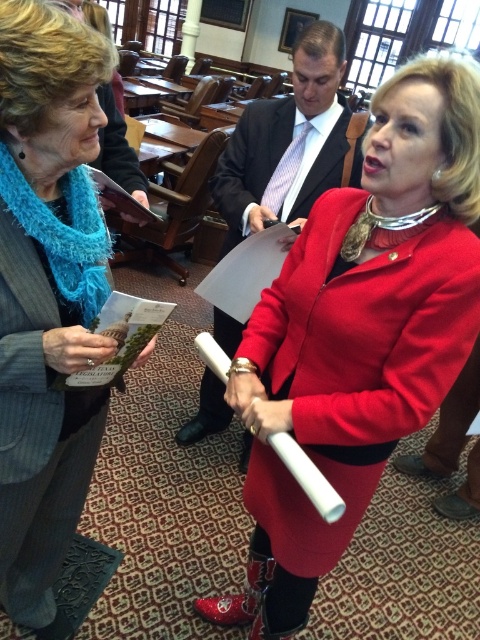
Question: Does matte red coat at center have a lesser width compared to matte blue scarf at left?

Choices:
 (A) yes
 (B) no

Answer: (B)

Question: In this image, where is matte red coat at center located relative to matte black suit at center?

Choices:
 (A) left
 (B) right

Answer: (B)

Question: Which point is farther to the camera?

Choices:
 (A) matte black suit at center
 (B) matte red coat at center

Answer: (A)

Question: Which object appears closest to the camera in this image?

Choices:
 (A) matte black suit at center
 (B) matte red coat at center

Answer: (B)

Question: Which point appears closest to the camera in this image?

Choices:
 (A) (467, 90)
 (B) (79, 97)

Answer: (B)

Question: Does matte red coat at center have a greater width compared to matte blue scarf at left?

Choices:
 (A) no
 (B) yes

Answer: (B)